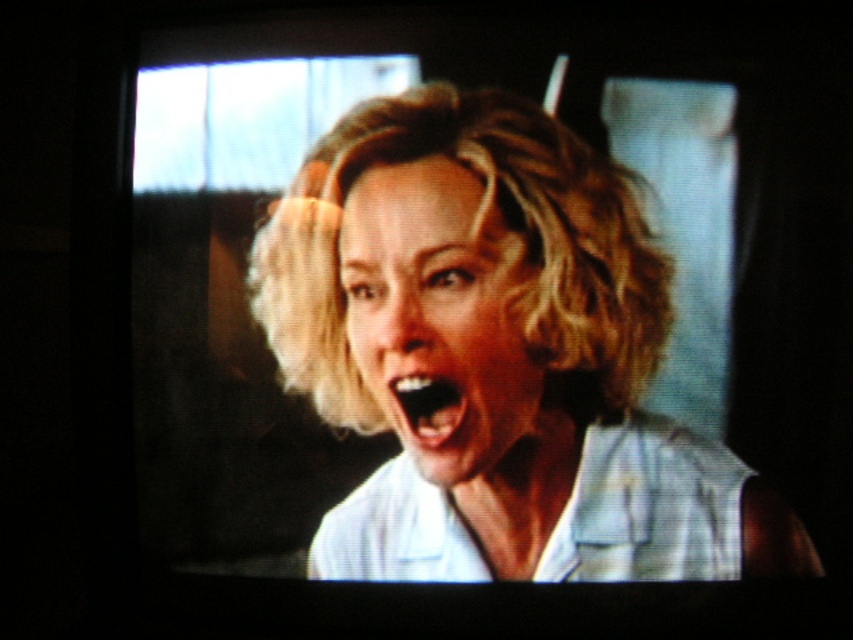
Measure the distance between point [479,374] and camera.

They are 31.81 inches apart.

Which of these two, white matte shirt at center or smooth white teeth at center, stands taller?

white matte shirt at center is taller.

Between point (564, 230) and point (450, 408), which one is positioned behind?

The point (450, 408) is more distant.

Identify the location of white matte shirt at center. (486, 340).

Who is more distant from viewer, (x=491, y=257) or (x=433, y=410)?

The point (x=433, y=410) is behind.

Can you confirm if blonde hair at center is thinner than smooth white teeth at center?

No, blonde hair at center is not thinner than smooth white teeth at center.

Locate an element on the screen. The height and width of the screenshot is (640, 853). blonde hair at center is located at coordinates (442, 321).

This screenshot has width=853, height=640. In order to click on white matte shirt at center in this screenshot , I will do `click(486, 340)`.

Is white matte shirt at center positioned before blonde hair at center?

Yes, it is.

Does point (502, 561) come in front of point (444, 326)?

No, it is not.

Where is `white matte shirt at center`? The width and height of the screenshot is (853, 640). white matte shirt at center is located at coordinates (486, 340).